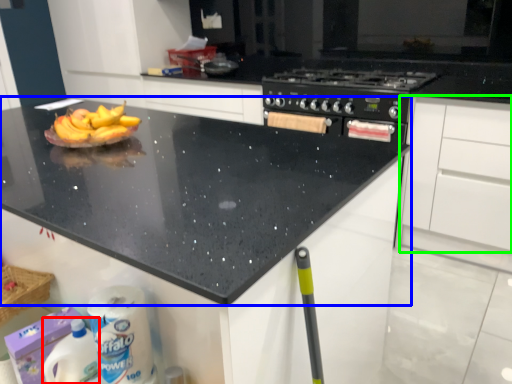
Question: Which is nearer to the cleaning product (highlighted by a red box)? countertop (highlighted by a blue box) or cabinetry (highlighted by a green box).

Choices:
 (A) countertop
 (B) cabinetry

Answer: (A)